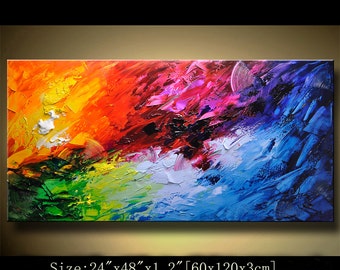
You are a GUI agent. You are given a task and a screenshot of the screen. Output one action in this format:
    pyautogui.click(x=<x>, y=<y>)
    Task: Click on the painting
    
    Given the screenshot: What is the action you would take?
    pyautogui.click(x=155, y=135)